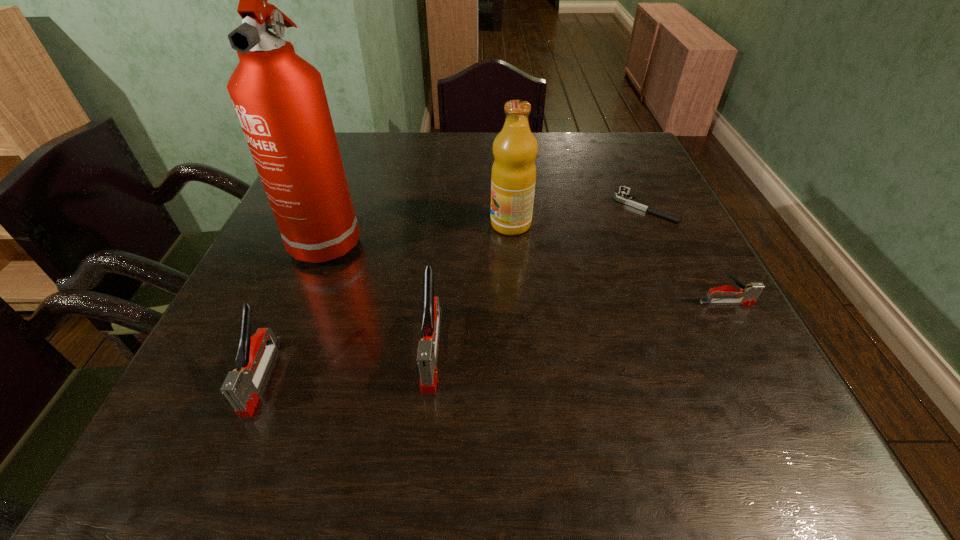
I want to click on blank space located 0.370m on the front-facing side of the pistol, so click(466, 206).

In order to click on vacant space situated 0.350m on the front-facing side of the pistol in this screenshot , I will do `click(473, 206)`.

You are a GUI agent. You are given a task and a screenshot of the screen. Output one action in this format:
    pyautogui.click(x=<x>, y=<y>)
    Task: Click on the free spot located 0.210m at the nozzle of the tallest object
    Image resolution: width=960 pixels, height=540 pixels.
    Given the screenshot: What is the action you would take?
    click(x=283, y=352)

Locate an element on the screen. free space located 0.130m on the front label of the fruit juice is located at coordinates (435, 224).

Image resolution: width=960 pixels, height=540 pixels. I want to click on free space located 0.160m on the front label of the fruit juice, so click(x=421, y=224).

Identify the location of vacant space located on the front label of the fruit juice. (332, 224).

Identify the location of stapler present at the left edge. This screenshot has width=960, height=540. (242, 386).

Locate an element on the screen. fire extinguisher that is at the left edge is located at coordinates (279, 98).

Locate an element on the screen. stapler located at the right edge is located at coordinates pyautogui.click(x=748, y=294).

The image size is (960, 540). I want to click on pistol that is at the right edge, so click(623, 197).